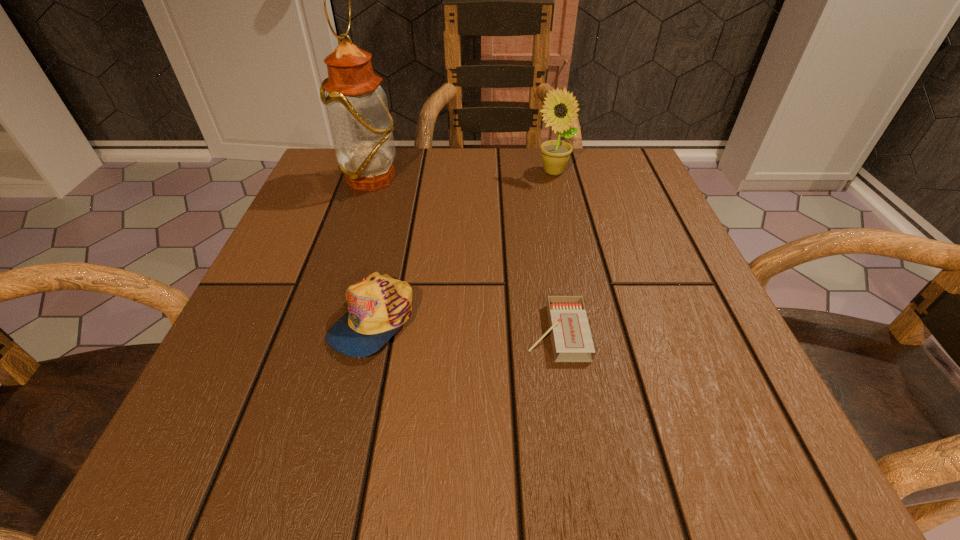
You are a GUI agent. You are given a task and a screenshot of the screen. Output one action in this format:
    pyautogui.click(x=<x>, y=<y>)
    Task: Click on the tallest object
    Image resolution: width=960 pixels, height=540 pixels.
    Given the screenshot: What is the action you would take?
    pyautogui.click(x=362, y=128)

This screenshot has height=540, width=960. In order to click on the second tallest object in this screenshot , I will do (x=560, y=110).

Image resolution: width=960 pixels, height=540 pixels. In order to click on the third tallest object in this screenshot , I will do `click(378, 305)`.

Where is `the shortest object`? the shortest object is located at coordinates (571, 337).

The height and width of the screenshot is (540, 960). What are the coordinates of `free space located 0.250m on the right of the tallest object` in the screenshot? It's located at (515, 179).

This screenshot has width=960, height=540. Find the location of `vacant space located on the face of the second tallest object`. vacant space located on the face of the second tallest object is located at coordinates (587, 321).

The image size is (960, 540). I want to click on free space located 0.120m on the bill of the cap, so click(344, 445).

This screenshot has height=540, width=960. Identify the location of vacant space positioned on the striking surface of the shortest object. (393, 332).

Find the location of a particular element. The image size is (960, 540). vacant space located 0.100m on the striking surface of the shortest object is located at coordinates (460, 332).

Image resolution: width=960 pixels, height=540 pixels. Identify the location of vacant area situated on the striking surface of the shortest object. (300, 332).